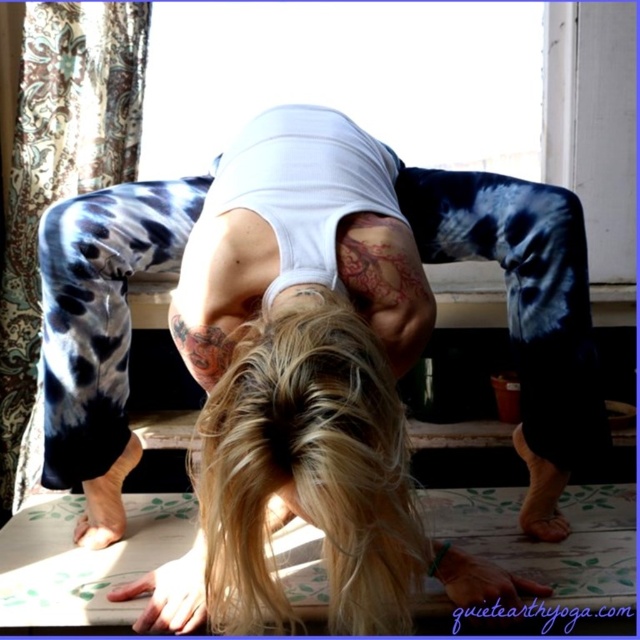
Who is more distant from viewer, (193, 602) or (632, 582)?

Positioned behind is point (632, 582).

This screenshot has height=640, width=640. Find the location of `tie-dye fabric pants at center`. tie-dye fabric pants at center is located at coordinates (308, 362).